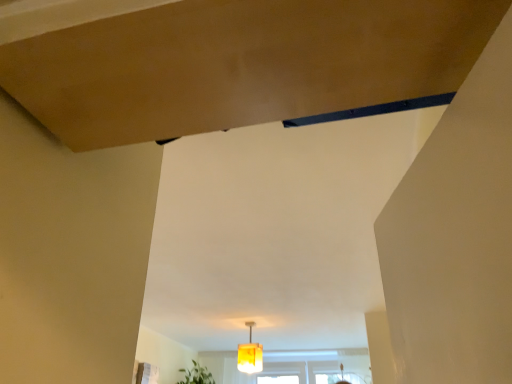
Question: Based on their positions, is green leafy plant at lower center located to the left or right of translucent yellow lampshade at center?

Choices:
 (A) left
 (B) right

Answer: (A)

Question: Considering the positions of green leafy plant at lower center and translucent yellow lampshade at center in the image, is green leafy plant at lower center bigger or smaller than translucent yellow lampshade at center?

Choices:
 (A) small
 (B) big

Answer: (B)

Question: From a real-world perspective, is green leafy plant at lower center physically located above or below translucent yellow lampshade at center?

Choices:
 (A) below
 (B) above

Answer: (A)

Question: In the image, is translucent yellow lampshade at center positioned in front of or behind green leafy plant at lower center?

Choices:
 (A) front
 (B) behind

Answer: (A)

Question: Looking at the image, does translucent yellow lampshade at center seem bigger or smaller compared to green leafy plant at lower center?

Choices:
 (A) small
 (B) big

Answer: (A)

Question: Considering the relative positions of translucent yellow lampshade at center and green leafy plant at lower center in the image provided, is translucent yellow lampshade at center to the left or to the right of green leafy plant at lower center?

Choices:
 (A) left
 (B) right

Answer: (B)

Question: From their relative heights in the image, would you say translucent yellow lampshade at center is taller or shorter than green leafy plant at lower center?

Choices:
 (A) tall
 (B) short

Answer: (A)